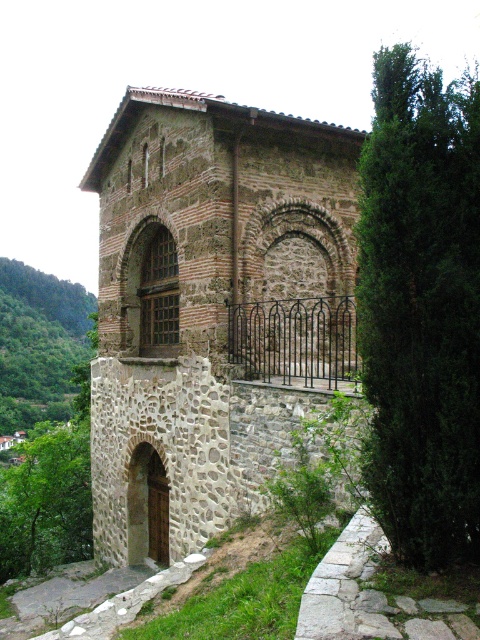
You are an architect assessing the structural integrity of the stone textured archway at center and the brown stone archway at lower left. Which archway has a larger span to support more weight?

The stone textured archway at center has a wider span than the brown stone archway at lower left, so it can support more weight.

You are an architect examining the stone structure. You need to determine the vertical arrangement of the stone textured archway at center and the brown stone archway at lower left. Which archway is positioned higher in the structure?

The stone textured archway at center is positioned higher than the brown stone archway at lower left as it is located above it.